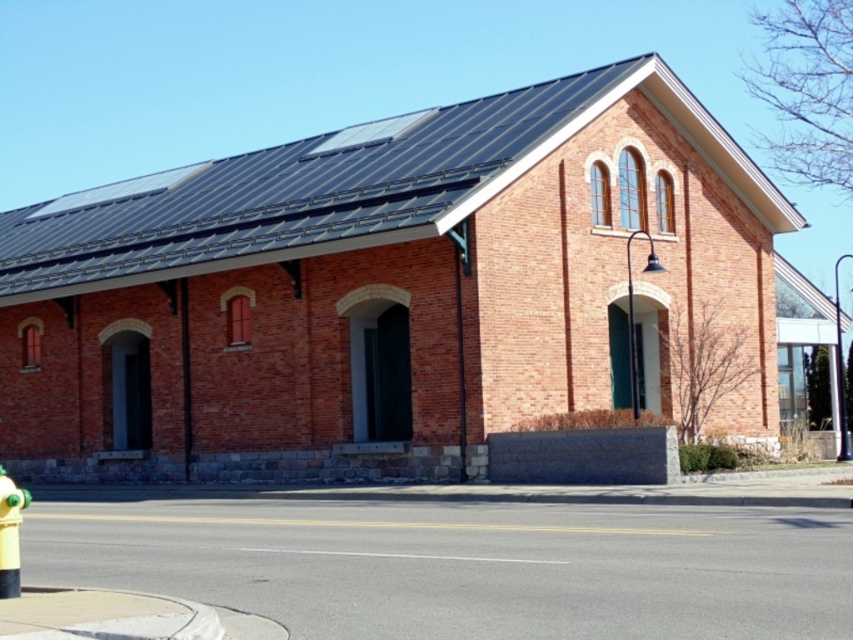
Is point (318, 156) positioned behind point (840, 413)?

Yes, it is.

Is brick building at center shorter than black metal pole at center?

Indeed, brick building at center has a lesser height compared to black metal pole at center.

Is point (215, 465) closer to viewer compared to point (846, 417)?

Yes, point (215, 465) is closer to viewer.

You are a GUI agent. You are given a task and a screenshot of the screen. Output one action in this format:
    pyautogui.click(x=<x>, y=<y>)
    Task: Click on the brick building at center
    The height and width of the screenshot is (640, 853).
    Given the screenshot: What is the action you would take?
    pyautogui.click(x=389, y=289)

Does brick building at center have a smaller size compared to yellow matte fire hydrant at lower left?

Incorrect, brick building at center is not smaller in size than yellow matte fire hydrant at lower left.

Identify the location of brick building at center. The image size is (853, 640). (389, 289).

Is point (190, 173) less distant than point (15, 493)?

That is False.

At what (x,y) coordinates should I click in order to perform the action: click on brick building at center. Please return your answer as a coordinate pair (x, y). The image size is (853, 640). Looking at the image, I should click on (389, 289).

Between point (4, 486) and point (842, 454), which one is positioned behind?

Positioned behind is point (842, 454).

Is point (9, 477) positioned behind point (842, 378)?

No, it is in front of (842, 378).

This screenshot has height=640, width=853. What do you see at coordinates (9, 532) in the screenshot? I see `yellow matte fire hydrant at lower left` at bounding box center [9, 532].

Where is `yellow matte fire hydrant at lower left`? yellow matte fire hydrant at lower left is located at coordinates (9, 532).